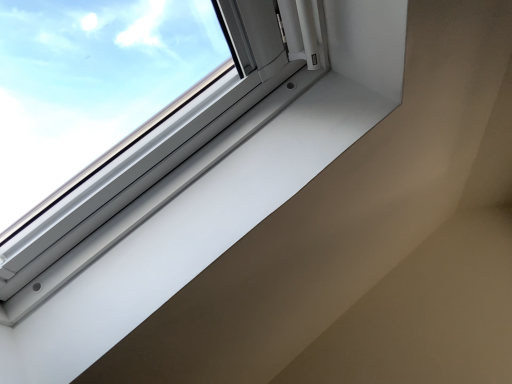
Where is `white plastic window at upper left`? The width and height of the screenshot is (512, 384). white plastic window at upper left is located at coordinates (128, 121).

The image size is (512, 384). What do you see at coordinates (128, 121) in the screenshot? I see `white plastic window at upper left` at bounding box center [128, 121].

At what (x,y) coordinates should I click in order to perform the action: click on white plastic window at upper left. Please return your answer as a coordinate pair (x, y). Looking at the image, I should click on (128, 121).